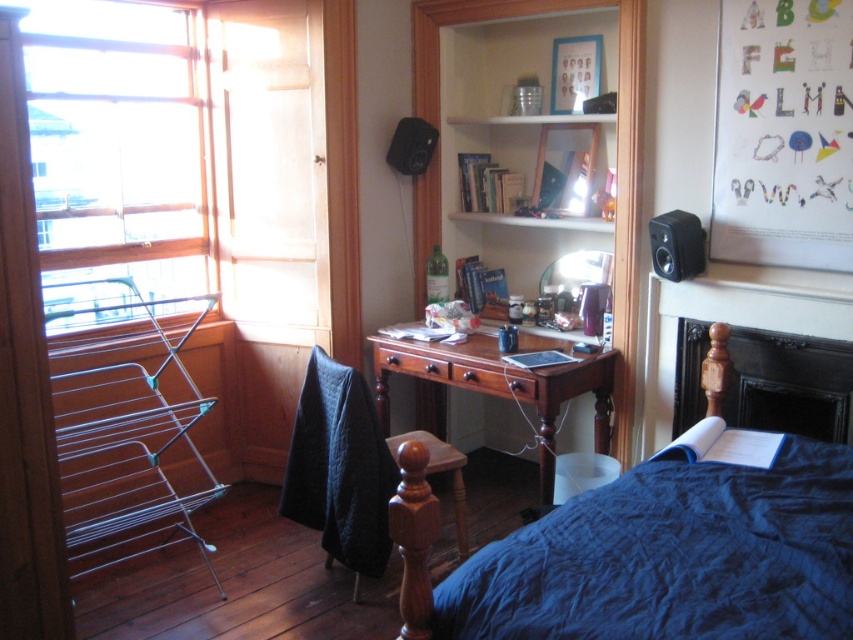
You are organizing a study space and need to place a new bookshelf. You see the wooden frame at left and the wooden bookshelf at upper center. Which object is located to the left of the other?

The wooden frame at left is positioned on the left side of wooden bookshelf at upper center, so the wooden frame at left is to the left of the wooden bookshelf at upper center.

You are organizing a small party in the room and need to place a 2.5 feet wide decorative board. You see the wooden frame at left and the wooden bookshelf at upper center. Which object can accommodate the board based on their widths?

The wooden bookshelf at upper center can accommodate the decorative board since it has a greater width than the wooden frame at left, as stated in the description.